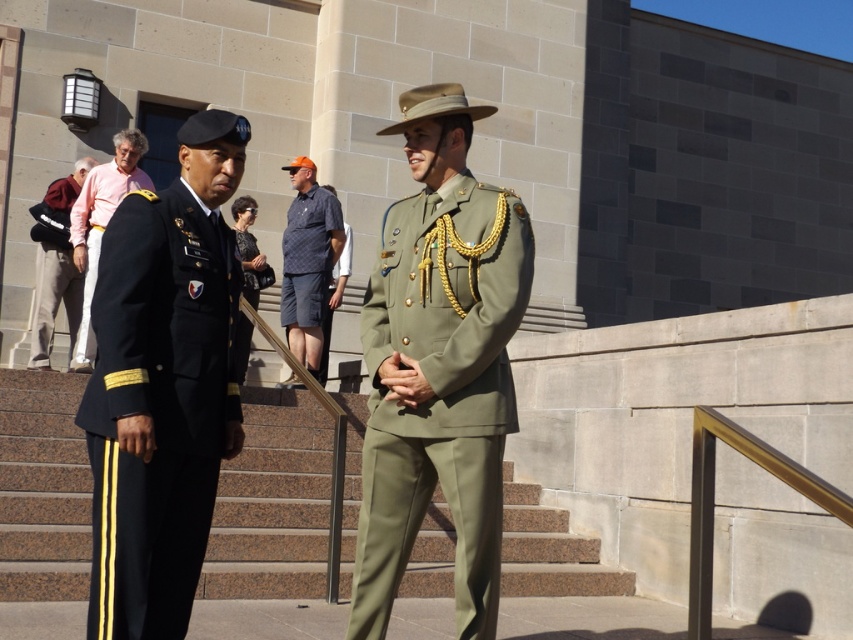
Question: Does dark blue fabric uniform at left appear on the left side of pink fabric shirt at left?

Choices:
 (A) yes
 (B) no

Answer: (B)

Question: Based on their relative distances, which object is nearer to the olive green fabric uniform at center?

Choices:
 (A) dark green fabric uniform at center
 (B) dark blue fabric uniform at left
 (C) dark gray pants at lower left

Answer: (B)

Question: Can you confirm if olive green fabric uniform at center is positioned below dark gray pants at lower left?

Choices:
 (A) no
 (B) yes

Answer: (B)

Question: Which of the following is the closest to the observer?

Choices:
 (A) dark blue fabric uniform at left
 (B) pink fabric shirt at left
 (C) orange fabric cap at center
 (D) olive green fabric uniform at center

Answer: (A)

Question: Can you confirm if brown stone stairs at center is thinner than dark green fabric uniform at center?

Choices:
 (A) yes
 (B) no

Answer: (B)

Question: Which of these objects is positioned closest to the olive green fabric uniform at center?

Choices:
 (A) dark blue fabric uniform at left
 (B) brown stone stairs at center
 (C) pink fabric shirt at left

Answer: (A)